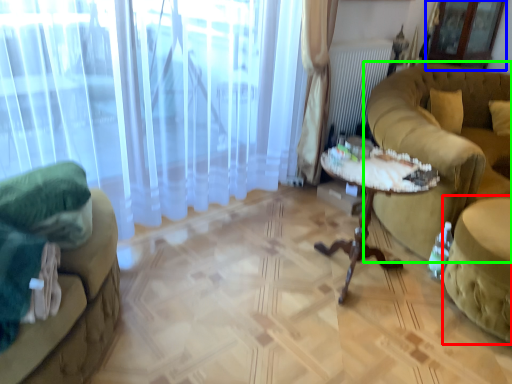
Question: Which is farther away from swivel chair (highlighted by a red box)? screen door (highlighted by a blue box) or studio couch (highlighted by a green box)?

Choices:
 (A) screen door
 (B) studio couch

Answer: (A)